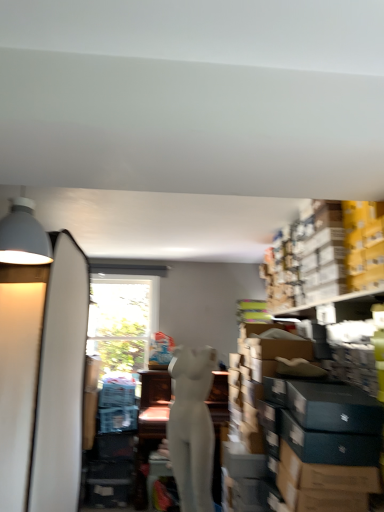
Question: Is yellow cardboard boxes at upper right completely or partially outside of white matte mannequin at center?

Choices:
 (A) yes
 (B) no

Answer: (A)

Question: From the image's perspective, does yellow cardboard boxes at upper right appear higher than white matte mannequin at center?

Choices:
 (A) yes
 (B) no

Answer: (A)

Question: Can white matte mannequin at center be found inside yellow cardboard boxes at upper right?

Choices:
 (A) no
 (B) yes

Answer: (A)

Question: Can you confirm if yellow cardboard boxes at upper right is positioned to the left of white matte mannequin at center?

Choices:
 (A) yes
 (B) no

Answer: (B)

Question: Is there a large distance between yellow cardboard boxes at upper right and white matte mannequin at center?

Choices:
 (A) yes
 (B) no

Answer: (A)

Question: From their relative heights in the image, would you say matte gray lampshade at upper left is taller or shorter than white matte mannequin at center?

Choices:
 (A) short
 (B) tall

Answer: (A)

Question: Looking at their shapes, would you say matte gray lampshade at upper left is wider or thinner than white matte mannequin at center?

Choices:
 (A) wide
 (B) thin

Answer: (A)

Question: Considering the relative positions of matte gray lampshade at upper left and white matte mannequin at center in the image provided, is matte gray lampshade at upper left to the left or to the right of white matte mannequin at center?

Choices:
 (A) right
 (B) left

Answer: (B)

Question: Is matte gray lampshade at upper left situated inside white matte mannequin at center or outside?

Choices:
 (A) inside
 (B) outside

Answer: (B)

Question: Is white matte surfboard at left inside the boundaries of matte gray lampshade at upper left, or outside?

Choices:
 (A) inside
 (B) outside

Answer: (B)

Question: Is white matte surfboard at left bigger or smaller than matte gray lampshade at upper left?

Choices:
 (A) small
 (B) big

Answer: (B)

Question: From the image's perspective, is white matte surfboard at left positioned above or below matte gray lampshade at upper left?

Choices:
 (A) above
 (B) below

Answer: (B)

Question: In terms of height, does white matte surfboard at left look taller or shorter compared to matte gray lampshade at upper left?

Choices:
 (A) short
 (B) tall

Answer: (B)

Question: In terms of size, does yellow cardboard boxes at upper right appear bigger or smaller than matte gray lampshade at upper left?

Choices:
 (A) big
 (B) small

Answer: (A)

Question: Does point (331, 229) appear closer or farther from the camera than point (23, 226)?

Choices:
 (A) closer
 (B) farther

Answer: (B)